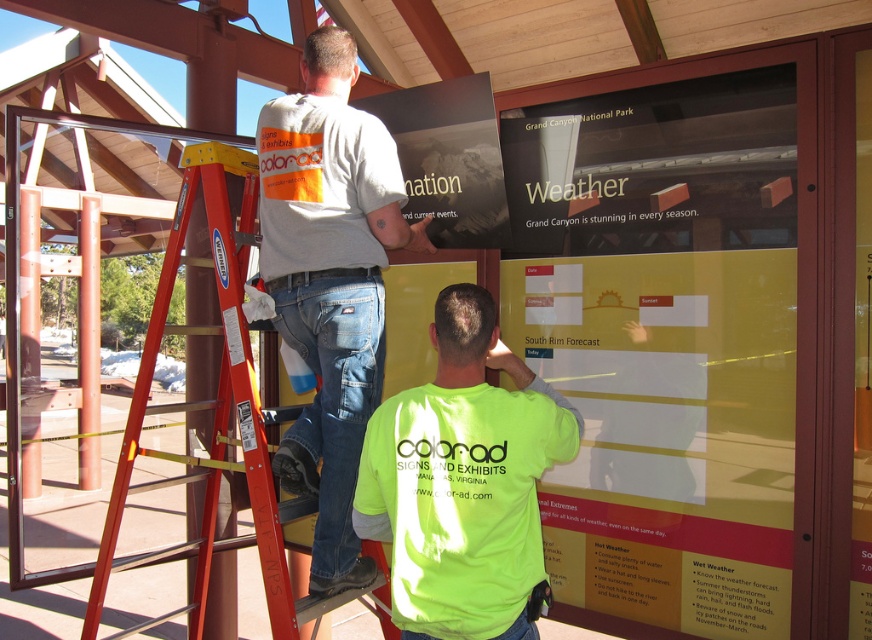
Question: Is neon green shirt at center positioned behind red metal ladder at left?

Choices:
 (A) yes
 (B) no

Answer: (B)

Question: Which point is farther to the camera?

Choices:
 (A) (268, 212)
 (B) (223, 417)

Answer: (B)

Question: Which of the following is the closest to the observer?

Choices:
 (A) neon green shirt at center
 (B) white cotton shirt at upper center

Answer: (A)

Question: Is neon green shirt at center bigger than red metal ladder at left?

Choices:
 (A) yes
 (B) no

Answer: (B)

Question: Which of these objects is positioned farthest from the red metal ladder at left?

Choices:
 (A) neon green shirt at center
 (B) white cotton shirt at upper center

Answer: (A)

Question: Is white cotton shirt at upper center smaller than red metal ladder at left?

Choices:
 (A) yes
 (B) no

Answer: (A)